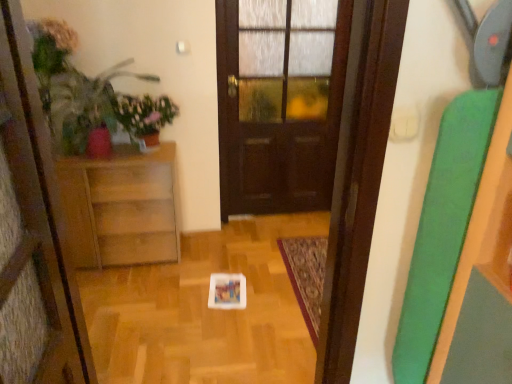
Describe the element at coordinates (120, 208) in the screenshot. The width and height of the screenshot is (512, 384). I see `wooden cabinet at left` at that location.

Locate an element on the screen. Image resolution: width=512 pixels, height=384 pixels. wooden cabinet at left is located at coordinates (120, 208).

I want to click on green matte plant at upper left, so click(x=144, y=116).

Looking at their sizes, would you say green matte plant at upper left is wider or thinner than wooden cabinet at left?

green matte plant at upper left is thinner than wooden cabinet at left.

The image size is (512, 384). In order to click on furniture on the left of green matte plant at upper left in this screenshot , I will do click(x=120, y=208).

Can you confirm if green matte plant at upper left is smaller than wooden cabinet at left?

Yes, green matte plant at upper left is smaller than wooden cabinet at left.

From a real-world perspective, which object rests below the other?

From a 3D spatial view, wooden cabinet at left is below.

Is green matte plant at upper left bigger or smaller than matte green plant at left?

Clearly, green matte plant at upper left is smaller in size than matte green plant at left.

Considering the sizes of green matte plant at upper left and matte green plant at left in the image, is green matte plant at upper left wider or thinner than matte green plant at left?

Clearly, green matte plant at upper left has less width compared to matte green plant at left.

Is green matte plant at upper left looking in the opposite direction of matte green plant at left?

Absolutely, green matte plant at upper left is directed away from matte green plant at left.

Is green matte plant at upper left behind matte green plant at left?

Yes, it is.

Considering the relative sizes of green matte plant at upper left and dark wood door at center in the image provided, is green matte plant at upper left wider than dark wood door at center?

Yes, green matte plant at upper left is wider than dark wood door at center.

Between green matte plant at upper left and dark wood door at center, which one has larger size?

dark wood door at center.

Is dark wood door at center surrounded by green matte plant at upper left?

No, dark wood door at center is not surrounded by green matte plant at upper left.

Locate an element on the screen. houseplant lying on the left of dark wood door at center is located at coordinates (144, 116).

Considering the positions of point (112, 182) and point (263, 80), is point (112, 182) closer or farther from the camera than point (263, 80)?

Point (112, 182) is positioned closer to the camera compared to point (263, 80).

The width and height of the screenshot is (512, 384). I want to click on furniture below the dark wood door at center (from a real-world perspective), so click(120, 208).

Based on the photo, are wooden cabinet at left and dark wood door at center located far from each other?

No, wooden cabinet at left is not far away from dark wood door at center.

Is wooden cabinet at left oriented away from dark wood door at center?

wooden cabinet at left is not turned away from dark wood door at center.

Between matte green plant at left and green matte plant at upper left, which one has less height?

green matte plant at upper left is shorter.

Can you tell me how much matte green plant at left and green matte plant at upper left differ in facing direction?

0.43 degrees separate the facing orientations of matte green plant at left and green matte plant at upper left.

Looking at this image, considering their positions, is matte green plant at left located in front of or behind green matte plant at upper left?

Clearly, matte green plant at left is in front of green matte plant at upper left.

Does matte green plant at left have a greater width compared to green matte plant at upper left?

Indeed, matte green plant at left has a greater width compared to green matte plant at upper left.

Is matte green plant at left positioned far away from wooden cabinet at left?

They are positioned close to each other.

Does matte green plant at left have a smaller size compared to wooden cabinet at left?

Yes, matte green plant at left is smaller than wooden cabinet at left.

In the image, is wooden cabinet at left positioned in front of or behind green matte plant at upper left?

wooden cabinet at left is positioned farther from the viewer than green matte plant at upper left.

How many degrees apart are the facing directions of wooden cabinet at left and green matte plant at upper left?

1.58 degrees.

Considering the sizes of objects wooden cabinet at left and green matte plant at upper left in the image provided, who is taller, wooden cabinet at left or green matte plant at upper left?

With more height is wooden cabinet at left.

Measure the distance between wooden cabinet at left and green matte plant at upper left.

They are 14.87 inches apart.

This screenshot has height=384, width=512. In the image, there is a green matte plant at upper left. Identify the location of furniture below it (from the image's perspective). (120, 208).

Find the location of `houseplant that appears below the matte green plant at left (from a real-world perspective)`. houseplant that appears below the matte green plant at left (from a real-world perspective) is located at coordinates (144, 116).

When comparing their distances from wooden cabinet at left, does green matte plant at upper left or dark wood door at center seem further?

Among the two, dark wood door at center is located further to wooden cabinet at left.

Looking at this image, looking at the image, which one is located further to green matte plant at upper left, wooden cabinet at left or matte green plant at left?

wooden cabinet at left.

From the image, which object appears to be farther from matte green plant at left, green matte plant at upper left or wooden cabinet at left?

wooden cabinet at left is further to matte green plant at left.

Looking at the image, which one is located further to wooden cabinet at left, matte green plant at left or dark wood door at center?

Among the two, dark wood door at center is located further to wooden cabinet at left.

Based on their spatial positions, is dark wood door at center or matte green plant at left closer to wooden cabinet at left?

The object closer to wooden cabinet at left is matte green plant at left.

From the image, which object appears to be farther from matte green plant at left, dark wood door at center or green matte plant at upper left?

The object further to matte green plant at left is dark wood door at center.

Estimate the real-world distances between objects in this image. Which object is further from matte green plant at left, dark wood door at center or wooden cabinet at left?

The object further to matte green plant at left is dark wood door at center.

Looking at the image, which one is located further to matte green plant at left, wooden cabinet at left or dark wood door at center?

Based on the image, dark wood door at center appears to be further to matte green plant at left.

Image resolution: width=512 pixels, height=384 pixels. I want to click on houseplant located between wooden cabinet at left and dark wood door at center in the left-right direction, so click(144, 116).

Locate an element on the screen. plant between wooden cabinet at left and dark wood door at center is located at coordinates (73, 87).

Where is `plant between green matte plant at upper left and wooden cabinet at left vertically`? Image resolution: width=512 pixels, height=384 pixels. plant between green matte plant at upper left and wooden cabinet at left vertically is located at coordinates (73, 87).

Where is `houseplant between matte green plant at left and dark wood door at center from left to right`? This screenshot has height=384, width=512. houseplant between matte green plant at left and dark wood door at center from left to right is located at coordinates (144, 116).